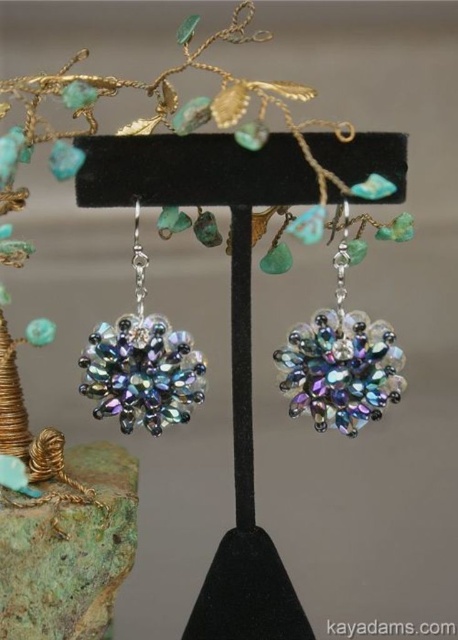
Question: Does iridescent glass earrings at center come in front of iridescent glass flower at center?

Choices:
 (A) yes
 (B) no

Answer: (A)

Question: Which of the following is the closest to the observer?

Choices:
 (A) iridescent glass earrings at center
 (B) iridescent glass flower at center

Answer: (A)

Question: Which point is farther to the camera?

Choices:
 (A) (123, 372)
 (B) (333, 349)

Answer: (A)

Question: Is iridescent glass earrings at center below iridescent glass flower at center?

Choices:
 (A) no
 (B) yes

Answer: (A)

Question: Can you confirm if iridescent glass earrings at center is smaller than iridescent glass flower at center?

Choices:
 (A) yes
 (B) no

Answer: (B)

Question: Among these points, which one is farthest from the camera?

Choices:
 (A) (408, 214)
 (B) (187, 385)

Answer: (B)